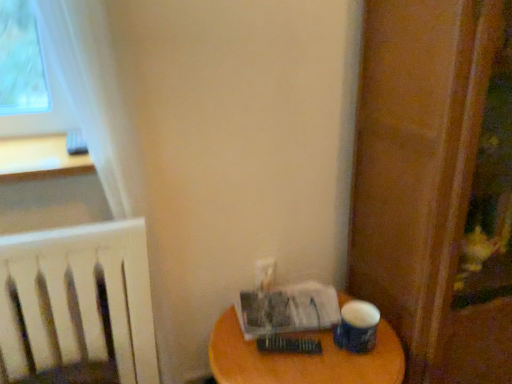
Find the location of a particular element. vacant area on top of wooden table at lower right (from a real-world perspective) is located at coordinates (300, 341).